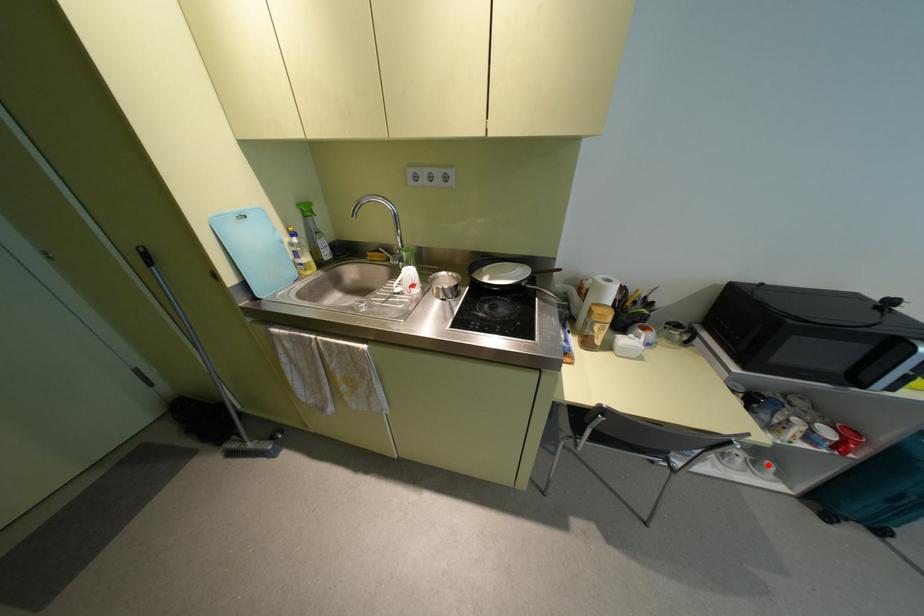
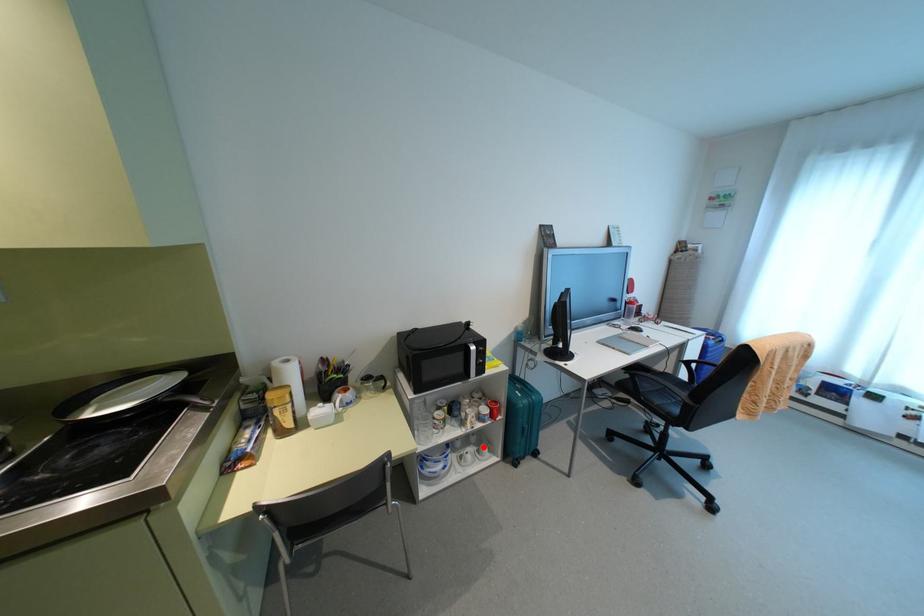
I am providing you with two images of the same scene from different viewpoints. A red point is marked on the first image and another point is marked on the second image. Is the marked point in image1 the same physical position as the marked point in image2?

Yes